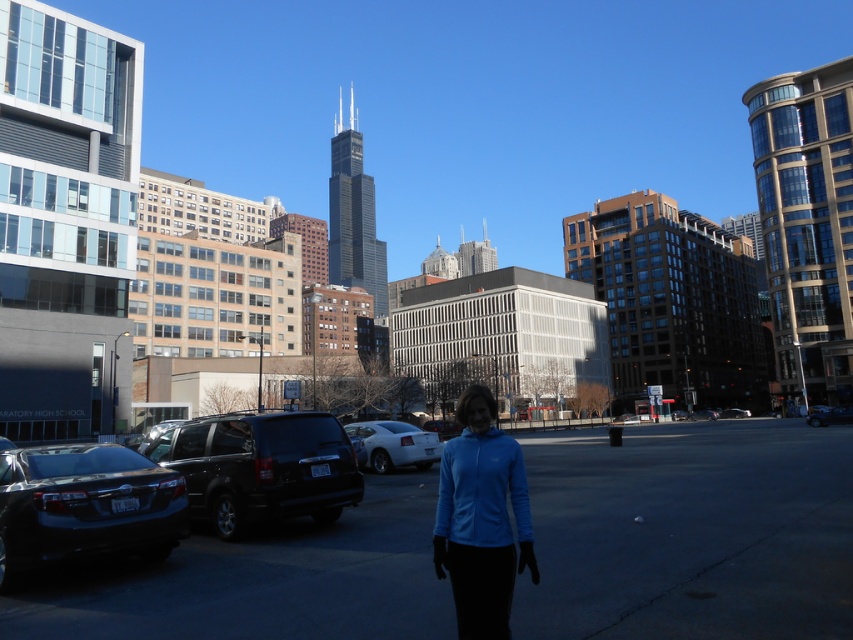
Question: Can you confirm if shiny black sedan at lower left is positioned below blue matte jacket at center?

Choices:
 (A) yes
 (B) no

Answer: (B)

Question: In this image, where is blue fabric parking lot at center located relative to shiny black suv at lower left?

Choices:
 (A) above
 (B) below

Answer: (B)

Question: Among these objects, which one is farthest from the camera?

Choices:
 (A) shiny black sedan at lower left
 (B) white glossy sedan at center

Answer: (B)

Question: Is blue fabric parking lot at center bigger than white glossy sedan at center?

Choices:
 (A) yes
 (B) no

Answer: (A)

Question: Which object appears closest to the camera in this image?

Choices:
 (A) shiny black suv at lower left
 (B) white glossy sedan at center

Answer: (A)

Question: Which object appears closest to the camera in this image?

Choices:
 (A) shiny black sedan at lower left
 (B) blue fabric parking lot at center
 (C) shiny black suv at lower left

Answer: (B)